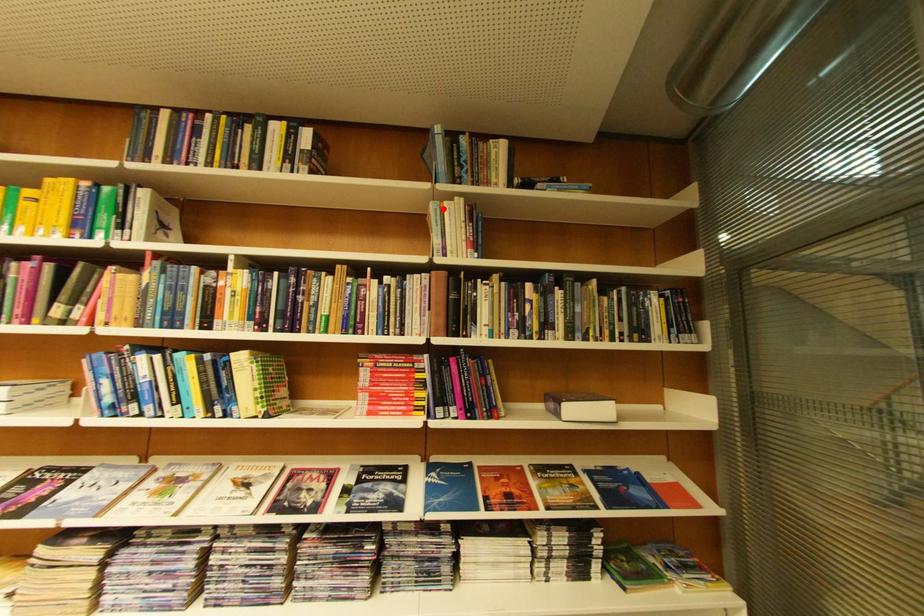
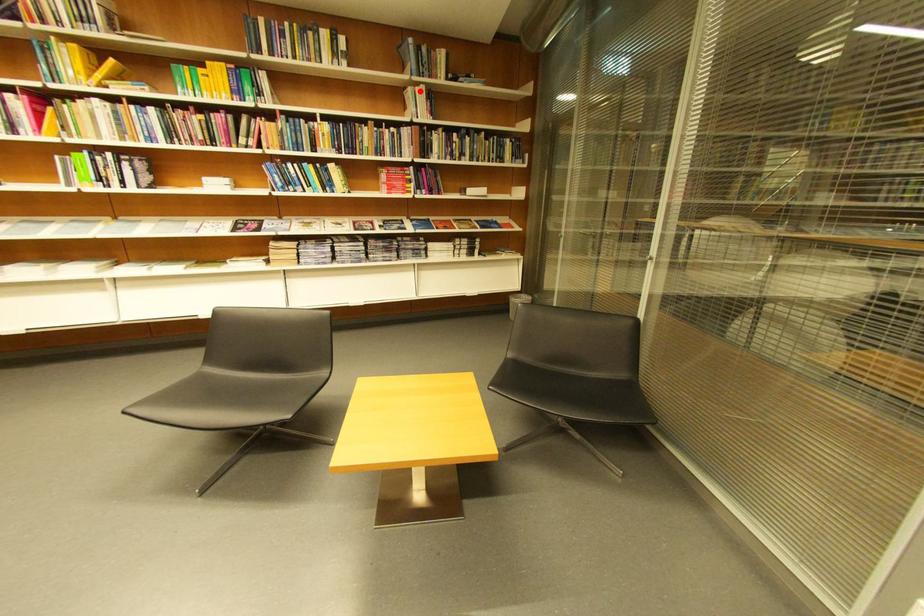
I am providing you with two images of the same scene from different viewpoints. A red point is marked on the first image and another point is marked on the second image. Does the point marked in image1 correspond to the same location as the one in image2?

Yes